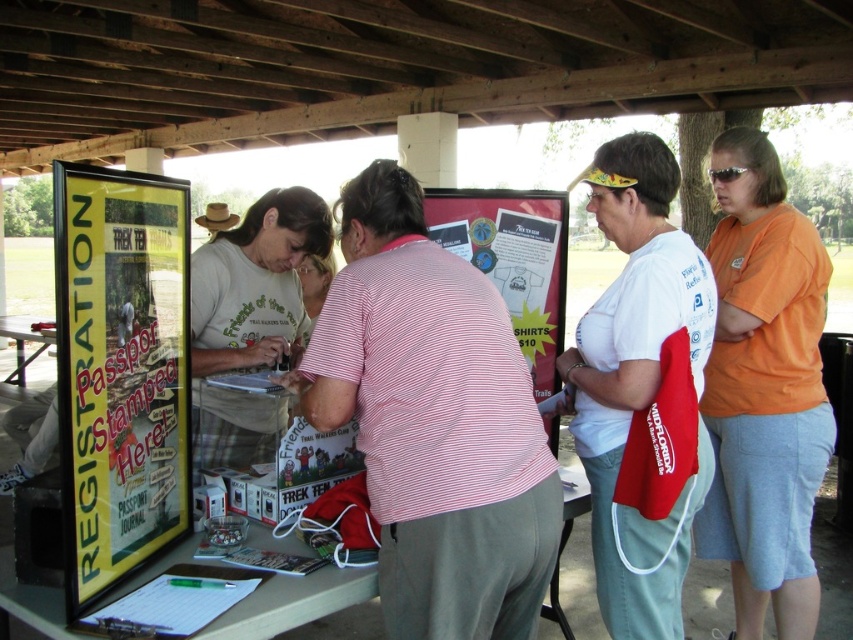
Between white cotton shirt at center and wooden table at center, which one appears on the right side from the viewer's perspective?

white cotton shirt at center

Does white cotton shirt at center appear under wooden table at center?

No, white cotton shirt at center is not below wooden table at center.

Find the location of a particular element. The image size is (853, 640). white cotton shirt at center is located at coordinates (634, 356).

Locate an element on the screen. The image size is (853, 640). white cotton shirt at center is located at coordinates (634, 356).

Who is positioned more to the left, yellow paperboard poster at left or orange cotton shirt at right?

From the viewer's perspective, yellow paperboard poster at left appears more on the left side.

Between yellow paperboard poster at left and orange cotton shirt at right, which one has more height?

orange cotton shirt at right

Find the location of `yellow paperboard poster at left`. yellow paperboard poster at left is located at coordinates pyautogui.click(x=120, y=371).

Where is `yellow paperboard poster at left`? This screenshot has height=640, width=853. yellow paperboard poster at left is located at coordinates (120, 371).

Is orange cotton shirt at right shorter than white cotton shirt at center?

Incorrect, orange cotton shirt at right's height does not fall short of white cotton shirt at center's.

Can you confirm if orange cotton shirt at right is taller than white cotton shirt at center?

Yes, orange cotton shirt at right is taller than white cotton shirt at center.

Does point (747, 426) come closer to viewer compared to point (637, 372)?

No, it is not.

Where is `orange cotton shirt at right`? This screenshot has width=853, height=640. orange cotton shirt at right is located at coordinates (764, 390).